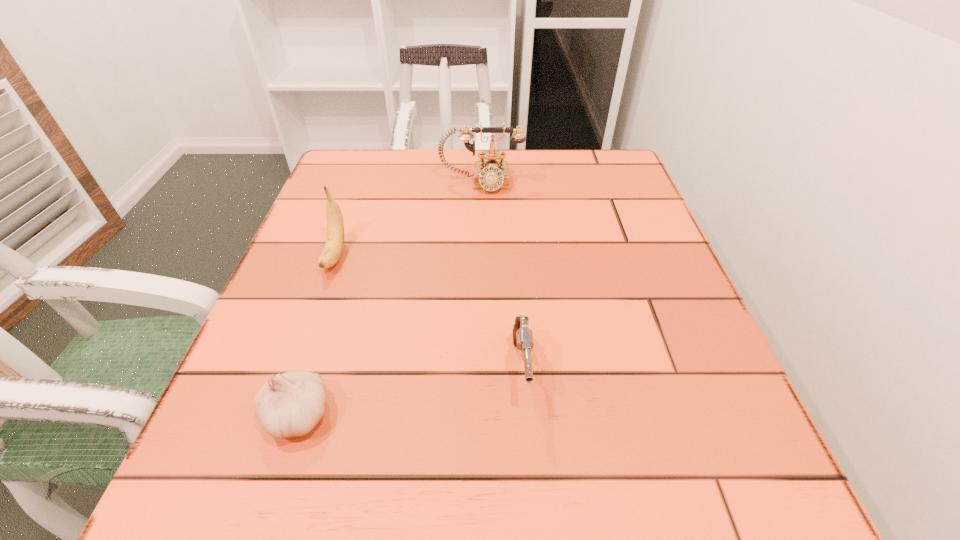
Locate an element on the screen. The height and width of the screenshot is (540, 960). the farthest object is located at coordinates click(x=491, y=175).

The width and height of the screenshot is (960, 540). Find the location of `the third nearest object`. the third nearest object is located at coordinates (333, 248).

Identify the location of pistol. (522, 336).

Where is `garlic`? garlic is located at coordinates (291, 404).

Find the location of `free spot located on the dial number of the farthest object`. free spot located on the dial number of the farthest object is located at coordinates (482, 240).

At what (x,y) coordinates should I click in order to perform the action: click on free space located 0.190m at the start of the peel on the third nearest object. Please return your answer as a coordinate pair (x, y). This screenshot has width=960, height=540. Looking at the image, I should click on (298, 361).

Image resolution: width=960 pixels, height=540 pixels. I want to click on vacant space located 0.140m at the barrel of the pistol, so click(534, 512).

The height and width of the screenshot is (540, 960). In order to click on vacant area located 0.200m on the right of the garlic in this screenshot , I will do `click(468, 415)`.

Where is `object that is positioned at the far edge`? object that is positioned at the far edge is located at coordinates (491, 175).

I want to click on banana present at the left edge, so click(x=333, y=248).